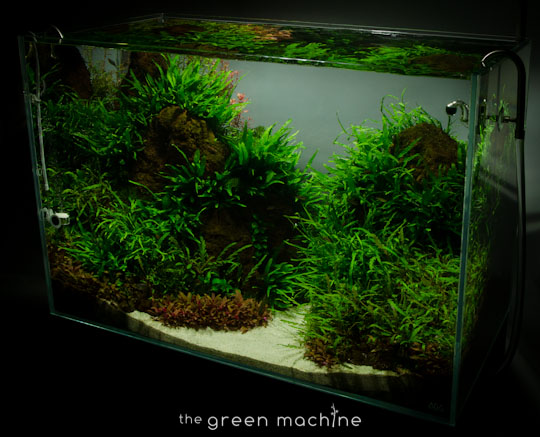
The image size is (540, 437). I want to click on floor, so click(269, 339).